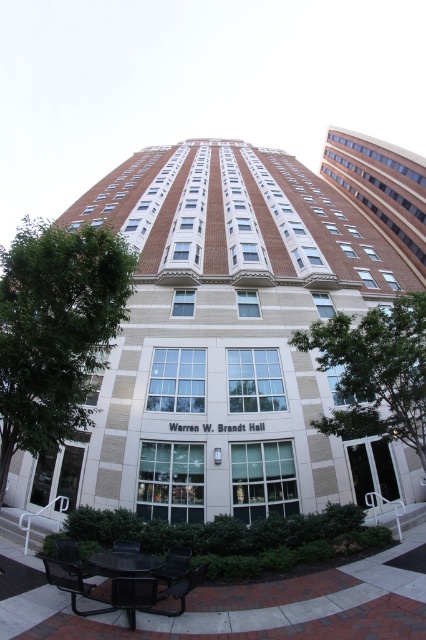
Consider the image. You are standing at the entrance of the brick building at center and want to sit on the metallic silver bench at lower left. Which direction should you walk to reach the bench?

The brick building at center is located above the metallic silver bench at lower left, so you should walk downward from the brick building at center to reach the metallic silver bench at lower left.

Looking at this image, you are a visitor standing in front of the brick textured building at upper right and want to sit down. Is the black metal bench at lower left within your line of sight without needing to move closer?

The brick textured building at upper right is taller than the black metal bench at lower left, so the bench is likely visible but its exact position depends on the surrounding landscaping. However, since the bench is at lower left and the building is at upper right, they are positioned apart, so the bench should be within sight unless obstructed.

You are a maintenance worker needing to move a 100 feet long hose from the brick textured building at upper right to the black metal bench at lower left. Will the hose reach the bench without needing to be extended?

The brick textured building at upper right and black metal bench at lower left are 141.15 feet apart from each other. Since the hose is only 100 feet long, it will not reach the bench without being extended.